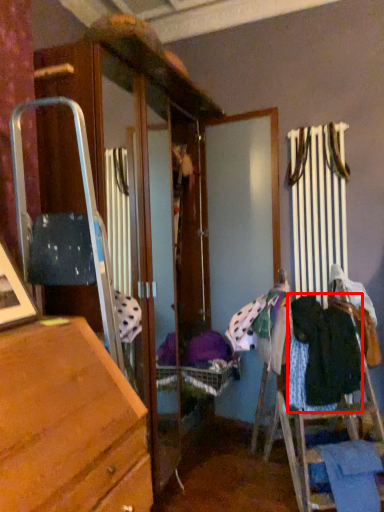
Question: In this image, where is clothing (annotated by the red box) located relative to clothing?

Choices:
 (A) left
 (B) right

Answer: (A)